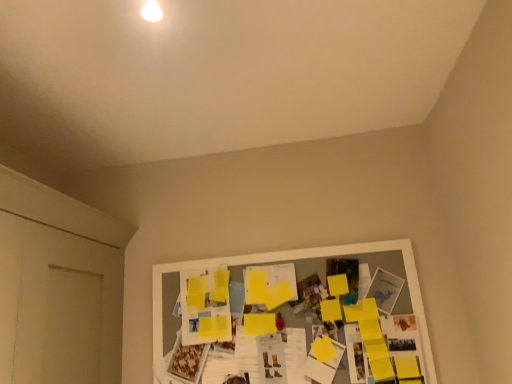
Question: Should I look upward or downward to see white matte door at left?

Choices:
 (A) up
 (B) down

Answer: (B)

Question: Can you confirm if white matte door at left is smaller than yellow paper at center?

Choices:
 (A) yes
 (B) no

Answer: (B)

Question: Is white matte door at left thinner than yellow paper at center?

Choices:
 (A) no
 (B) yes

Answer: (A)

Question: From the image's perspective, is white matte door at left beneath yellow paper at center?

Choices:
 (A) no
 (B) yes

Answer: (A)

Question: Does white matte door at left appear on the right side of yellow paper at center?

Choices:
 (A) yes
 (B) no

Answer: (B)

Question: Is white matte door at left not inside yellow paper at center?

Choices:
 (A) yes
 (B) no

Answer: (A)

Question: Is white matte door at left positioned behind yellow paper at center?

Choices:
 (A) yes
 (B) no

Answer: (B)

Question: Does yellow paper at center contain white matte door at left?

Choices:
 (A) no
 (B) yes

Answer: (A)

Question: From the image's perspective, is yellow paper at center located beneath white matte door at left?

Choices:
 (A) no
 (B) yes

Answer: (B)

Question: From a real-world perspective, is yellow paper at center positioned over white matte door at left based on gravity?

Choices:
 (A) yes
 (B) no

Answer: (B)

Question: Can you confirm if yellow paper at center is wider than white matte door at left?

Choices:
 (A) no
 (B) yes

Answer: (A)

Question: Are yellow paper at center and white matte door at left beside each other?

Choices:
 (A) no
 (B) yes

Answer: (A)

Question: Is yellow paper at center outside of white matte door at left?

Choices:
 (A) no
 (B) yes

Answer: (B)

Question: Which is correct: yellow paper at center is inside white matte door at left, or outside of it?

Choices:
 (A) outside
 (B) inside

Answer: (A)